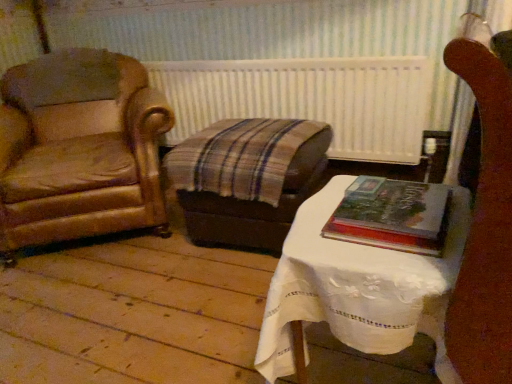
Find the location of a particular element. free space to the left of hardcover book at center right is located at coordinates pyautogui.click(x=316, y=221).